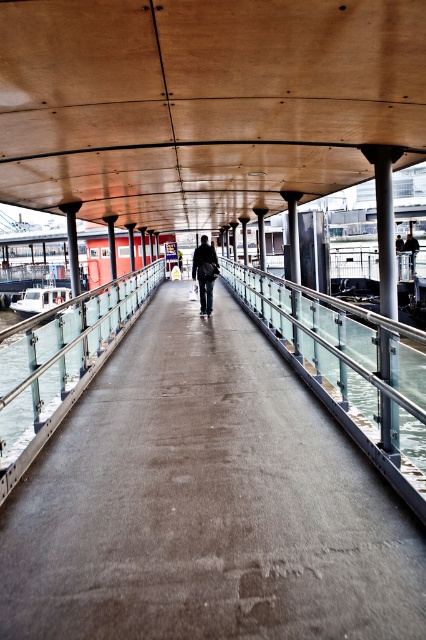
Question: Among these points, which one is farthest from the camera?

Choices:
 (A) (400, 428)
 (B) (374, 45)
 (C) (207, 307)

Answer: (C)

Question: Which of these objects is positioned farthest from the wooden ceiling at center?

Choices:
 (A) concrete walkway at center
 (B) clear glass railing at left

Answer: (A)

Question: Does wooden ceiling at center appear under clear glass railing at left?

Choices:
 (A) yes
 (B) no

Answer: (B)

Question: Can you confirm if clear glass railing at center is bigger than clear glass railing at left?

Choices:
 (A) no
 (B) yes

Answer: (B)

Question: Which point is farther to the camera?

Choices:
 (A) (192, 269)
 (B) (350, 371)
 (C) (0, 390)

Answer: (A)

Question: Does wooden ceiling at center have a smaller size compared to clear glass railing at center?

Choices:
 (A) yes
 (B) no

Answer: (A)